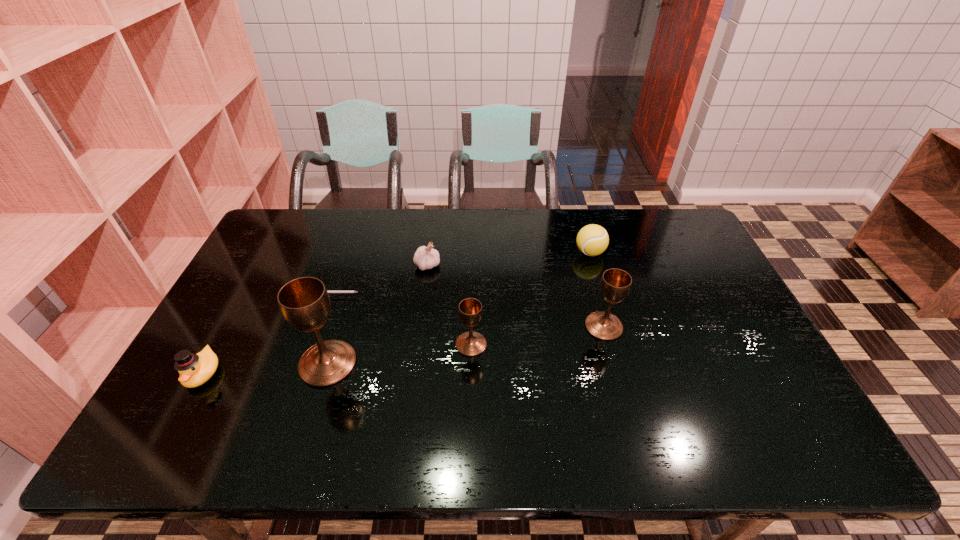
I want to click on the tallest chalice, so click(304, 302).

This screenshot has height=540, width=960. What are the coordinates of `the tallest object` in the screenshot? It's located at (304, 302).

This screenshot has width=960, height=540. Identify the location of the second chalice from right to left. (471, 343).

At what (x,y) coordinates should I click in order to perform the action: click on the third tallest object. Please return your answer as a coordinate pair (x, y). The image size is (960, 540). Looking at the image, I should click on (471, 343).

Locate an element on the screen. The image size is (960, 540). the rightmost chalice is located at coordinates (615, 284).

At what (x,y) coordinates should I click in order to perform the action: click on the sixth shortest object. Please return your answer as a coordinate pair (x, y). Looking at the image, I should click on (615, 284).

Identify the location of screwdriver. The width and height of the screenshot is (960, 540). (327, 291).

Identify the location of the fifth nearest object. This screenshot has width=960, height=540. (327, 291).

Identify the location of the fourth object from left to right. (425, 257).

You are a GUI agent. You are given a task and a screenshot of the screen. Output one action in this format:
    pyautogui.click(x=<x>, y=<y>)
    Task: Click on the tennis ball
    This screenshot has height=540, width=960.
    Given the screenshot: What is the action you would take?
    pyautogui.click(x=592, y=240)